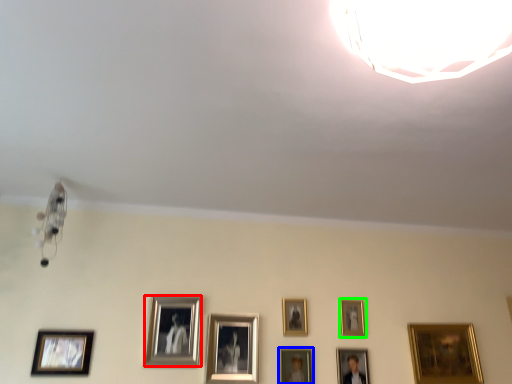
Question: Which is nearer to the picture frame (highlighted by a red box)? picture frame (highlighted by a blue box) or picture frame (highlighted by a green box).

Choices:
 (A) picture frame
 (B) picture frame

Answer: (A)